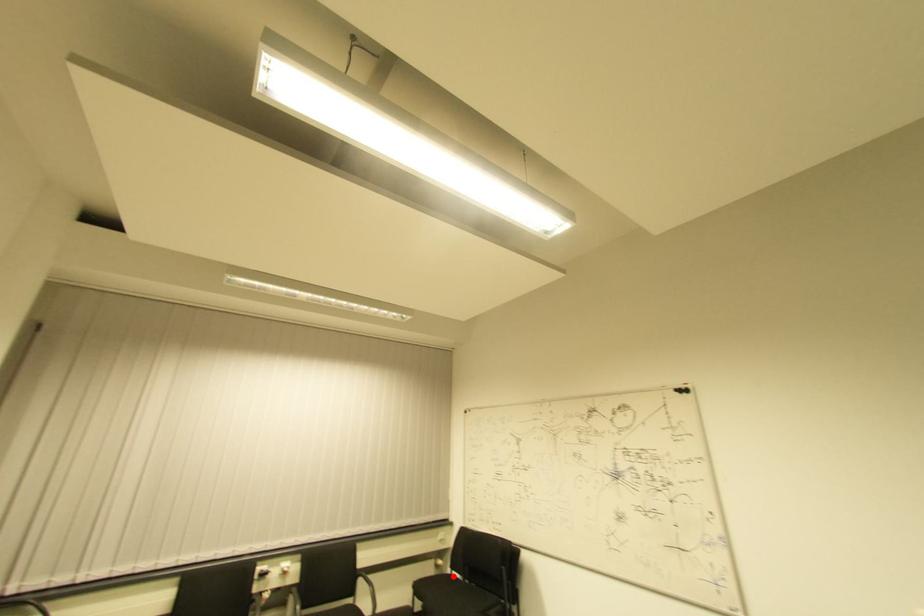
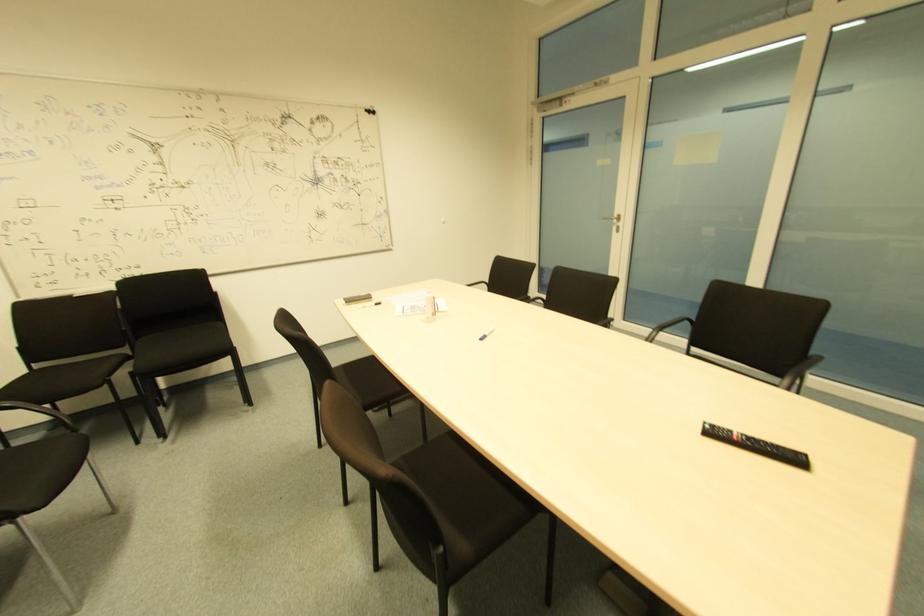
Question: I am providing you with two images of the same scene from different viewpoints. A red point is shown in image1. For the corresponding object point in image2, is it positioned nearer or farther from the camera?

Choices:
 (A) Nearer
 (B) Farther

Answer: (B)